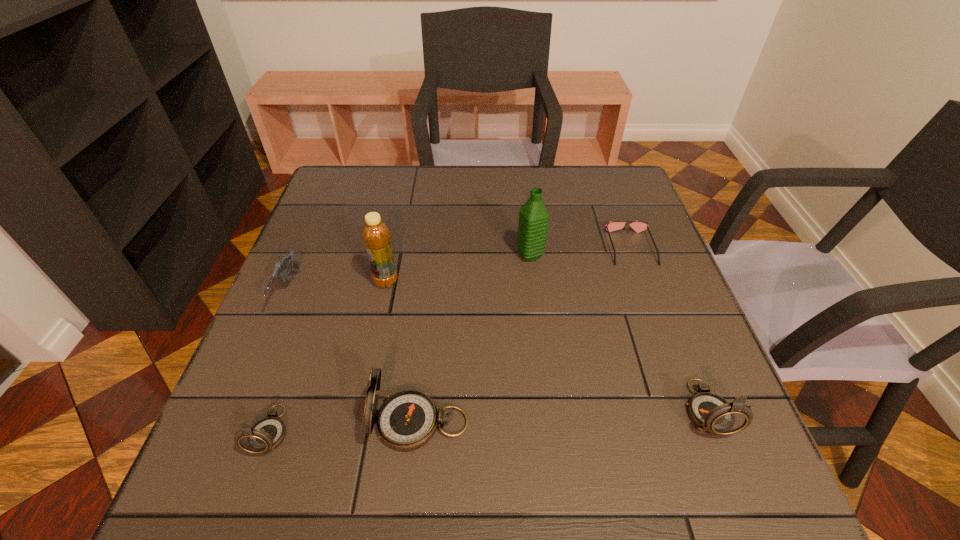
Identify the location of free spot between the water bottle and the second compass from left to right. This screenshot has width=960, height=540. (475, 339).

At what (x,y) coordinates should I click in order to perform the action: click on free space between the gun and the tallest compass. Please return your answer as a coordinate pair (x, y). This screenshot has height=540, width=960. Looking at the image, I should click on 354,358.

Locate an element on the screen. unoccupied position between the second object from left to right and the shortest object is located at coordinates (450, 339).

At what (x,y) coordinates should I click in order to perform the action: click on vacant space that's between the leftmost object and the shortest compass. Please return your answer as a coordinate pair (x, y). The height and width of the screenshot is (540, 960). Looking at the image, I should click on (279, 362).

At what (x,y) coordinates should I click in order to perform the action: click on empty location between the leftmost object and the second shortest compass. Please return your answer as a coordinate pair (x, y). Looking at the image, I should click on (497, 351).

Where is `free spot between the shortest object and the gun`? The height and width of the screenshot is (540, 960). free spot between the shortest object and the gun is located at coordinates (460, 271).

Identify the location of free area in between the sunglasses and the rightmost compass. The image size is (960, 540). (668, 328).

Identify the location of free space between the second compass from left to right and the gun. (354, 358).

You are a GUI agent. You are given a task and a screenshot of the screen. Output one action in this format:
    pyautogui.click(x=<x>, y=<y>)
    Task: Click on the empty location between the water bottle and the second shortest compass
    This screenshot has height=540, width=960.
    Given the screenshot: What is the action you would take?
    pyautogui.click(x=618, y=332)

The width and height of the screenshot is (960, 540). I want to click on vacant area between the shortest compass and the water bottle, so click(x=400, y=343).